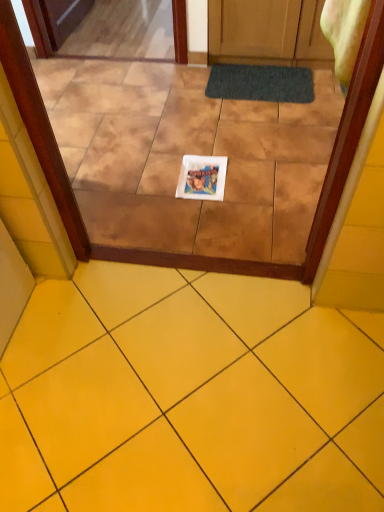
The height and width of the screenshot is (512, 384). Identify the location of vacant space to the left of white paper at center. (150, 179).